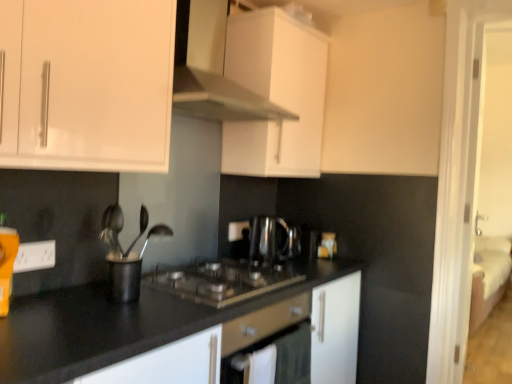
Based on the photo, measure the distance between point (x=277, y=235) and camera.

Point (x=277, y=235) and camera are 2.12 meters apart from each other.

The height and width of the screenshot is (384, 512). Describe the element at coordinates (269, 240) in the screenshot. I see `satin black coffee machine at center` at that location.

Measure the distance between black stainless steel gas stove at center and camera.

A distance of 4.72 feet exists between black stainless steel gas stove at center and camera.

Identify the location of black granite countertop at center. The image size is (512, 384). (114, 326).

Consider the image. Measure the distance between black granite countertop at center and camera.

black granite countertop at center is 35.80 inches away from camera.

Describe the element at coordinates (88, 83) in the screenshot. I see `white glossy cabinet at upper left, marked as the third cabinetry in a back-to-front arrangement` at that location.

What do you see at coordinates (125, 276) in the screenshot? This screenshot has height=384, width=512. I see `black matte utensil holder at center` at bounding box center [125, 276].

Measure the distance between point [283,110] and camera.

Point [283,110] and camera are 1.85 meters apart.

What is the approximate width of white glossy cabinet at upper center, the 2th cabinetry in the back-to-front sequence?

The width of white glossy cabinet at upper center, the 2th cabinetry in the back-to-front sequence, is 19.13 inches.

Where is `satin black coffee machine at center`? satin black coffee machine at center is located at coordinates coord(269,240).

Where is `the 1st cabinetry behind when counting from the black granite countertop at center`? This screenshot has height=384, width=512. the 1st cabinetry behind when counting from the black granite countertop at center is located at coordinates (88, 83).

Which is more to the left, black granite countertop at center or white glossy cabinet at upper left, marked as the third cabinetry in a back-to-front arrangement?

From the viewer's perspective, white glossy cabinet at upper left, marked as the third cabinetry in a back-to-front arrangement, appears more on the left side.

Is black granite countertop at center oriented away from white glossy cabinet at upper left, placed as the first cabinetry when sorted from front to back?

No, white glossy cabinet at upper left, placed as the first cabinetry when sorted from front to back, is not at the back of black granite countertop at center.

Between black granite countertop at center and white glossy cabinet at upper left, placed as the first cabinetry when sorted from front to back, which one has smaller size?

white glossy cabinet at upper left, placed as the first cabinetry when sorted from front to back, is smaller.

Is black matte utensil holder at center not within white plastic electrical outlet at lower left?

Yes, black matte utensil holder at center is not within white plastic electrical outlet at lower left.

Looking at this image, is black matte utensil holder at center far from white plastic electrical outlet at lower left?

No, black matte utensil holder at center is not far away from white plastic electrical outlet at lower left.

In the image, there is a white plastic electrical outlet at lower left. Where is `appliance below it (from the image's perspective)`? This screenshot has height=384, width=512. appliance below it (from the image's perspective) is located at coordinates (125, 276).

Between black matte utensil holder at center and white plastic electrical outlet at lower left, which one is positioned in front?

black matte utensil holder at center is more forward.

From the image's perspective, is black stainless steel gas stove at center positioned above or below white plastic electrical outlet at lower left?

black stainless steel gas stove at center is below white plastic electrical outlet at lower left.

Where is `electric outlet in front of the black stainless steel gas stove at center`? electric outlet in front of the black stainless steel gas stove at center is located at coordinates (35, 256).

Can you tell me how much black stainless steel gas stove at center and white plastic electrical outlet at lower left differ in facing direction?

The angle between the facing direction of black stainless steel gas stove at center and the facing direction of white plastic electrical outlet at lower left is 1.12 degrees.

In the scene shown: Which of these two, black stainless steel gas stove at center or white plastic electrical outlet at lower left, stands shorter?

Standing shorter between the two is white plastic electrical outlet at lower left.

Identify the location of cabinetry that is the 2nd one when counting leftward from the black stainless steel gas stove at center. (88, 83).

From a real-world perspective, who is located higher, white glossy cabinet at upper left, placed as the first cabinetry when sorted from front to back, or black stainless steel gas stove at center?

In real-world perspective, white glossy cabinet at upper left, placed as the first cabinetry when sorted from front to back, is above.

Is white glossy cabinet at upper left, placed as the first cabinetry when sorted from front to back, beside black stainless steel gas stove at center?

No, white glossy cabinet at upper left, placed as the first cabinetry when sorted from front to back, is not making contact with black stainless steel gas stove at center.

In the scene shown: Which of these two, white glossy cabinet at upper left, placed as the first cabinetry when sorted from front to back, or black stainless steel gas stove at center, stands taller?

white glossy cabinet at upper left, placed as the first cabinetry when sorted from front to back, is taller.

Is black granite countertop at center wider than black stainless steel gas stove at center?

Yes, black granite countertop at center is wider than black stainless steel gas stove at center.

Can you confirm if black granite countertop at center is smaller than black stainless steel gas stove at center?

Actually, black granite countertop at center might be larger than black stainless steel gas stove at center.

Considering the relative sizes of black granite countertop at center and black stainless steel gas stove at center in the image provided, is black granite countertop at center shorter than black stainless steel gas stove at center?

In fact, black granite countertop at center may be taller than black stainless steel gas stove at center.

Could you tell me if black granite countertop at center is facing black stainless steel gas stove at center?

No, black granite countertop at center does not turn towards black stainless steel gas stove at center.

Based on the photo, from a real-world perspective, between white matte cabinet at upper center, which is the 1th cabinetry from back to front, and black matte utensil holder at center, who is vertically higher?

In real-world perspective, white matte cabinet at upper center, which is the 1th cabinetry from back to front, is above.

Identify the location of appliance on the left of the white matte cabinet at upper center, which is the third cabinetry from front to back. (125, 276).

Could you measure the distance between white matte cabinet at upper center, which is the third cabinetry from front to back, and black matte utensil holder at center?

white matte cabinet at upper center, which is the third cabinetry from front to back, and black matte utensil holder at center are 1.10 meters apart from each other.

Between white matte cabinet at upper center, which is the 1th cabinetry from back to front, and black matte utensil holder at center, which one has more height?

Standing taller between the two is white matte cabinet at upper center, which is the 1th cabinetry from back to front.

Considering the positions of objects white glossy cabinet at upper center, positioned as the second cabinetry in front-to-back order, and satin black coffee machine at center in the image provided, who is in front, white glossy cabinet at upper center, positioned as the second cabinetry in front-to-back order, or satin black coffee machine at center?

white glossy cabinet at upper center, positioned as the second cabinetry in front-to-back order.

How different are the orientations of white glossy cabinet at upper center, positioned as the second cabinetry in front-to-back order, and satin black coffee machine at center in degrees?

8.07e-05 degrees separate the facing orientations of white glossy cabinet at upper center, positioned as the second cabinetry in front-to-back order, and satin black coffee machine at center.

Considering the relative sizes of white glossy cabinet at upper center, positioned as the second cabinetry in front-to-back order, and satin black coffee machine at center in the image provided, is white glossy cabinet at upper center, positioned as the second cabinetry in front-to-back order, shorter than satin black coffee machine at center?

No, white glossy cabinet at upper center, positioned as the second cabinetry in front-to-back order, is not shorter than satin black coffee machine at center.

Find the location of `countertop below the white glossy cabinet at upper left, marked as the third cabinetry in a back-to-front arrangement (from a real-world perspective)`. countertop below the white glossy cabinet at upper left, marked as the third cabinetry in a back-to-front arrangement (from a real-world perspective) is located at coordinates [114, 326].

Identify the location of appliance below the white plastic electrical outlet at lower left (from the image's perspective). (125, 276).

Based on the photo, considering their positions, is black granite countertop at center positioned further to black stainless steel gas stove at center than white matte cabinet at upper center, which is the third cabinetry from front to back?

white matte cabinet at upper center, which is the third cabinetry from front to back, lies further to black stainless steel gas stove at center than the other object.

Estimate the real-world distances between objects in this image. Which object is further from white matte cabinet at upper center, which is the third cabinetry from front to back, black stainless steel gas stove at center or satin black coffee machine at center?

Based on the image, black stainless steel gas stove at center appears to be further to white matte cabinet at upper center, which is the third cabinetry from front to back.

From the image, which object appears to be nearer to white glossy cabinet at upper left, marked as the third cabinetry in a back-to-front arrangement, polished metal spoon at center or white glossy cabinet at upper center, positioned as the second cabinetry in front-to-back order?

Among the two, white glossy cabinet at upper center, positioned as the second cabinetry in front-to-back order, is located nearer to white glossy cabinet at upper left, marked as the third cabinetry in a back-to-front arrangement.

Estimate the real-world distances between objects in this image. Which object is closer to white glossy cabinet at upper center, positioned as the second cabinetry in front-to-back order, polished metal spoon at center or black granite countertop at center?

Based on the image, polished metal spoon at center appears to be nearer to white glossy cabinet at upper center, positioned as the second cabinetry in front-to-back order.

From the picture: Which object lies nearer to the anchor point white matte cabinet at upper center, which is the third cabinetry from front to back, black granite countertop at center or polished metal spoon at center?

The object closer to white matte cabinet at upper center, which is the third cabinetry from front to back, is polished metal spoon at center.

Looking at the image, which one is located closer to polished metal spoon at center, satin black coffee machine at center or white plastic electrical outlet at lower left?

white plastic electrical outlet at lower left is positioned closer to the anchor polished metal spoon at center.

Looking at the image, which one is located closer to polished metal spoon at center, white plastic electrical outlet at lower left or black stainless steel gas stove at center?

The object closer to polished metal spoon at center is white plastic electrical outlet at lower left.

Considering their positions, is black stainless steel gas stove at center positioned further to satin black coffee machine at center than white glossy cabinet at upper left, marked as the third cabinetry in a back-to-front arrangement?

white glossy cabinet at upper left, marked as the third cabinetry in a back-to-front arrangement, is further to satin black coffee machine at center.

I want to click on coffee machine between white glossy cabinet at upper center, the 2th cabinetry in the back-to-front sequence, and black granite countertop at center, in the vertical direction, so click(x=269, y=240).

The height and width of the screenshot is (384, 512). Identify the location of gas stove that lies between white glossy cabinet at upper center, positioned as the second cabinetry in front-to-back order, and black granite countertop at center from top to bottom. (222, 281).

Where is `electric outlet that lies between white glossy cabinet at upper center, positioned as the second cabinetry in front-to-back order, and black stainless steel gas stove at center from top to bottom`? The image size is (512, 384). electric outlet that lies between white glossy cabinet at upper center, positioned as the second cabinetry in front-to-back order, and black stainless steel gas stove at center from top to bottom is located at coordinates (35, 256).

Where is `gas stove positioned between white glossy cabinet at upper left, marked as the third cabinetry in a back-to-front arrangement, and satin black coffee machine at center from near to far`? The width and height of the screenshot is (512, 384). gas stove positioned between white glossy cabinet at upper left, marked as the third cabinetry in a back-to-front arrangement, and satin black coffee machine at center from near to far is located at coordinates (222, 281).